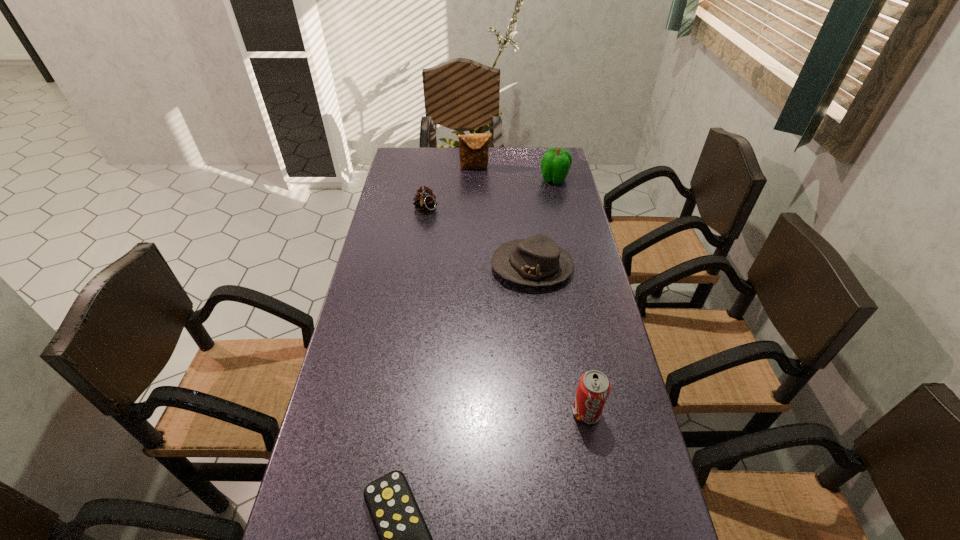
Locate which object is the fifth closest to the bell pepper. Please provide its 2D coordinates. Your answer should be formatted as a tuple, i.e. [(x, y)], where the tuple contains the x and y coordinates of a point satisfying the conditions above.

[(404, 539)]

Locate which object is the second closest to the nearest object. Please provide its 2D coordinates. Your answer should be formatted as a tuple, i.e. [(x, y)], where the tuple contains the x and y coordinates of a point satisfying the conditions above.

[(537, 261)]

This screenshot has height=540, width=960. Find the location of `free location that satisfies the following two spatial constraints: 1. with a leaf charm attached to the pinecone; 2. on the right side of the fifth farthest object`. free location that satisfies the following two spatial constraints: 1. with a leaf charm attached to the pinecone; 2. on the right side of the fifth farthest object is located at coordinates (395, 412).

Find the location of `vacant region that satisfies the following two spatial constraints: 1. with a leaf charm attached to the pinecone; 2. on the right side of the second nearest object`. vacant region that satisfies the following two spatial constraints: 1. with a leaf charm attached to the pinecone; 2. on the right side of the second nearest object is located at coordinates (395, 412).

Locate an element on the screen. This screenshot has height=540, width=960. vacant space that satisfies the following two spatial constraints: 1. with a leaf charm attached to the pinecone; 2. on the right side of the soda can is located at coordinates (395, 412).